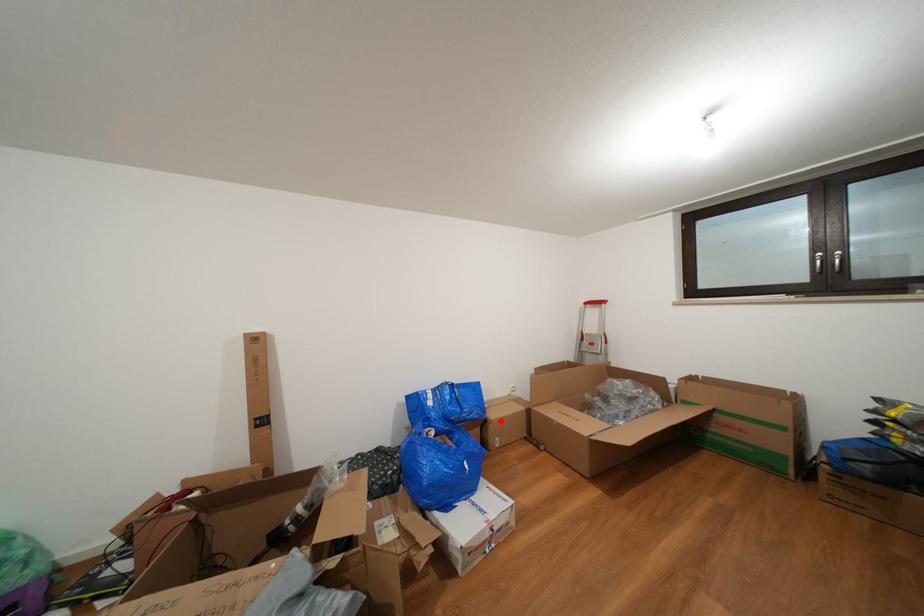
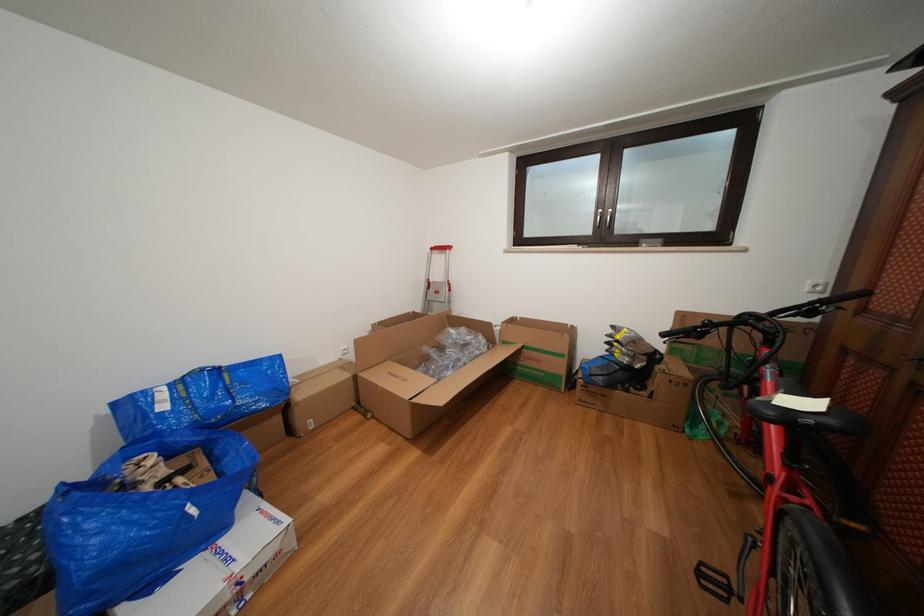
Question: I am providing you with two images of the same scene from different viewpoints. Image1 has a red point marked. In image2, the corresponding 3D location appears at what relative position? Reply with the corresponding letter.

Choices:
 (A) Closer
 (B) Farther

Answer: (A)